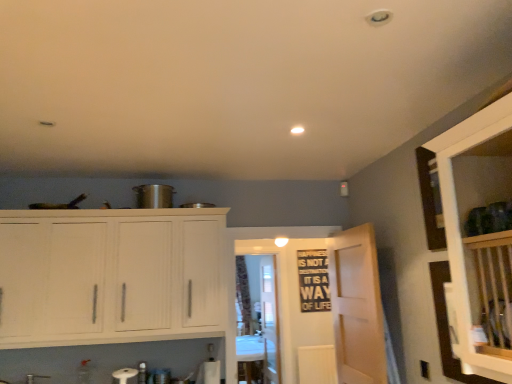
Question: Which direction should I rotate to look at transparent glass door at center, placed as the first glass door when sorted from back to front?

Choices:
 (A) left
 (B) right

Answer: (B)

Question: Can you confirm if black matte bulletin board at center is bigger than white wood cabinets at left?

Choices:
 (A) no
 (B) yes

Answer: (A)

Question: Is black matte bulletin board at center positioned behind white wood cabinets at left?

Choices:
 (A) no
 (B) yes

Answer: (B)

Question: From the image's perspective, does black matte bulletin board at center appear lower than white wood cabinets at left?

Choices:
 (A) no
 (B) yes

Answer: (B)

Question: Is black matte bulletin board at center at the right side of white wood cabinets at left?

Choices:
 (A) yes
 (B) no

Answer: (A)

Question: Considering the relative positions of black matte bulletin board at center and white wood cabinets at left in the image provided, is black matte bulletin board at center in front of white wood cabinets at left?

Choices:
 (A) no
 (B) yes

Answer: (A)

Question: Is black matte bulletin board at center at the left side of white wood cabinets at left?

Choices:
 (A) yes
 (B) no

Answer: (B)

Question: Does patterned fabric curtain at center have a smaller size compared to light wood door at center?

Choices:
 (A) no
 (B) yes

Answer: (A)

Question: Does patterned fabric curtain at center lie behind light wood door at center?

Choices:
 (A) yes
 (B) no

Answer: (A)

Question: Does patterned fabric curtain at center contain light wood door at center?

Choices:
 (A) no
 (B) yes

Answer: (A)

Question: Can you confirm if patterned fabric curtain at center is wider than light wood door at center?

Choices:
 (A) yes
 (B) no

Answer: (A)

Question: Is patterned fabric curtain at center aimed at light wood door at center?

Choices:
 (A) yes
 (B) no

Answer: (A)

Question: Can you confirm if patterned fabric curtain at center is bigger than light wood door at center?

Choices:
 (A) yes
 (B) no

Answer: (A)

Question: Can you confirm if black matte bulletin board at center is positioned to the right of patterned fabric curtain at center?

Choices:
 (A) yes
 (B) no

Answer: (A)